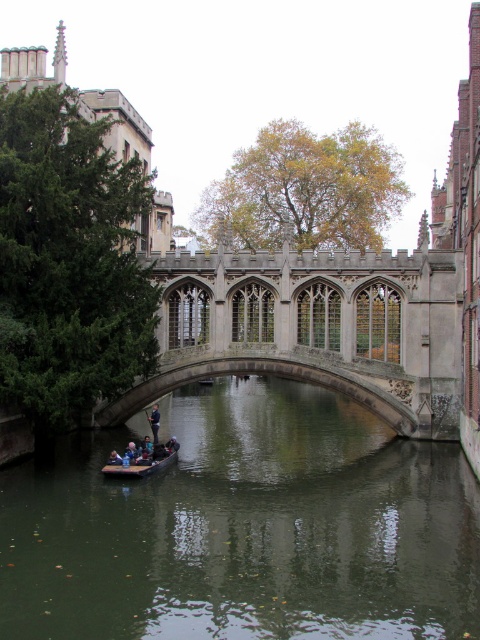
Question: Which of these objects is positioned farthest from the dark blue fabric jacket at center?

Choices:
 (A) stone gothic bridge at center
 (B) wooden canoe at center

Answer: (A)

Question: Can you confirm if green murky water at center is positioned above stone gothic bridge at center?

Choices:
 (A) no
 (B) yes

Answer: (A)

Question: Among these points, which one is farthest from the camera?

Choices:
 (A) (156, 433)
 (B) (273, 385)

Answer: (B)

Question: Does green murky water at center have a lesser width compared to wooden canoe at center?

Choices:
 (A) no
 (B) yes

Answer: (A)

Question: Does stone gothic bridge at center appear under wooden canoe at center?

Choices:
 (A) yes
 (B) no

Answer: (B)

Question: Among these points, which one is nearest to the camera?

Choices:
 (A) (148, 461)
 (B) (393, 420)
 (C) (94, 493)
 (D) (154, 432)

Answer: (C)